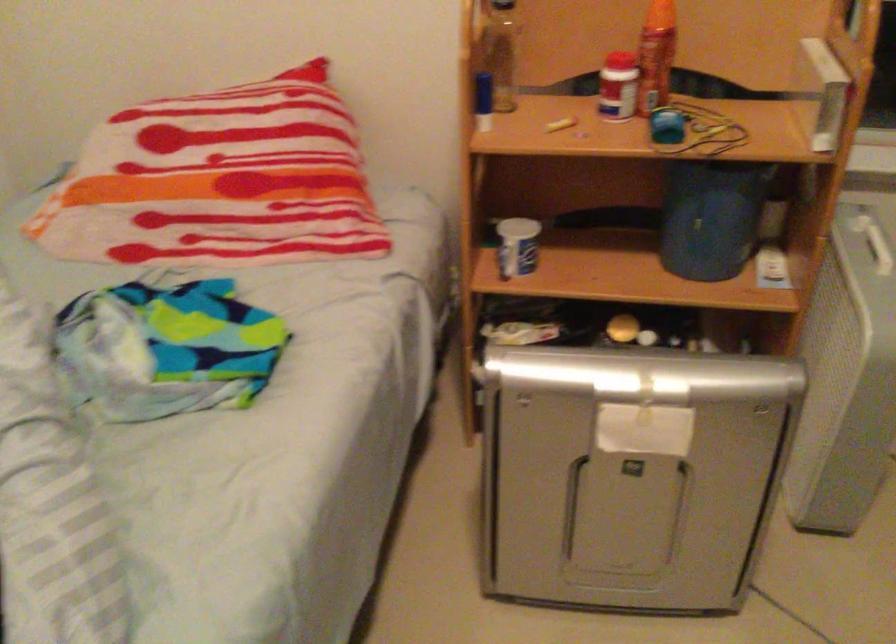
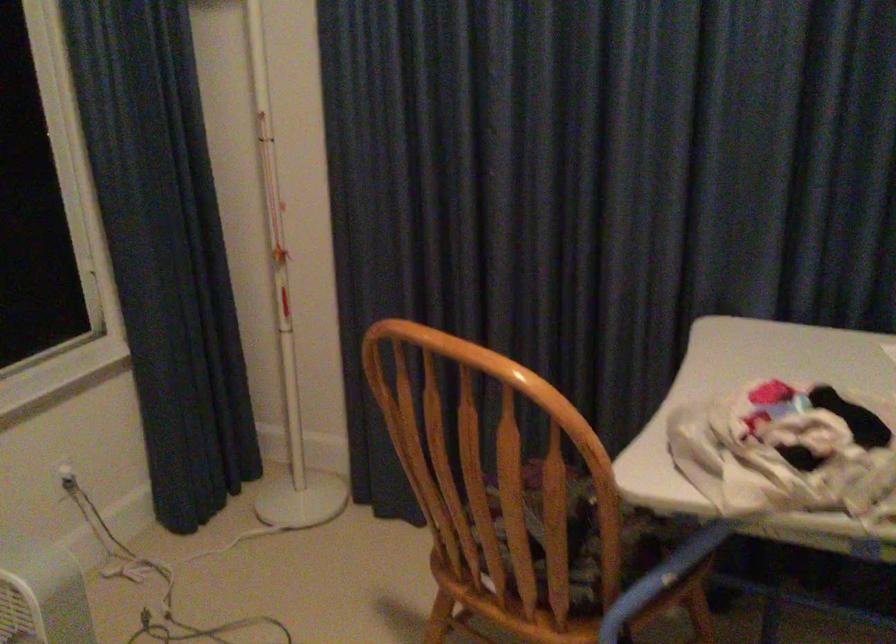
Question: The images are taken continuously from a first-person perspective. In which direction is your viewpoint rotating?

Choices:
 (A) Left
 (B) Right
 (C) Up
 (D) Down

Answer: (B)